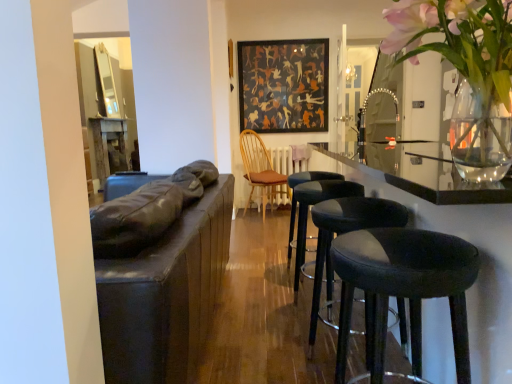
Locate an element on the screen. The width and height of the screenshot is (512, 384). vacant space positioned to the left of black leather stool at center, the fourth stool in the front-to-back sequence is located at coordinates (266, 278).